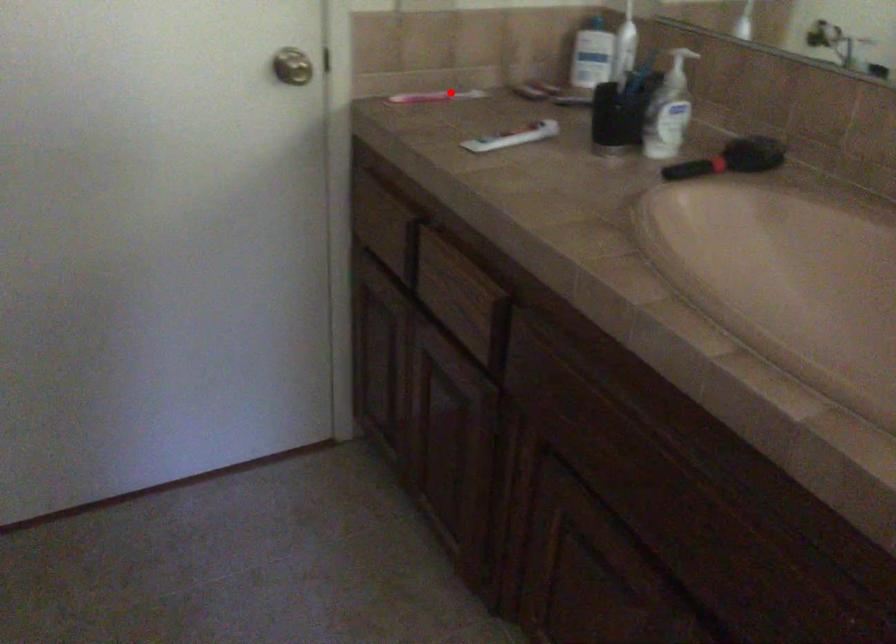
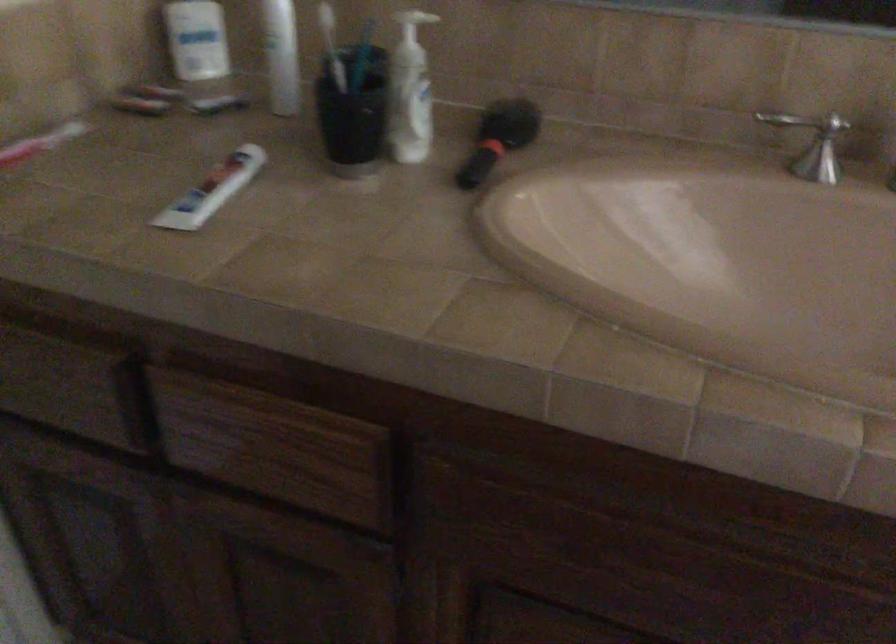
In the second image, find the point that corresponds to the highlighted location in the first image.

(42, 145)